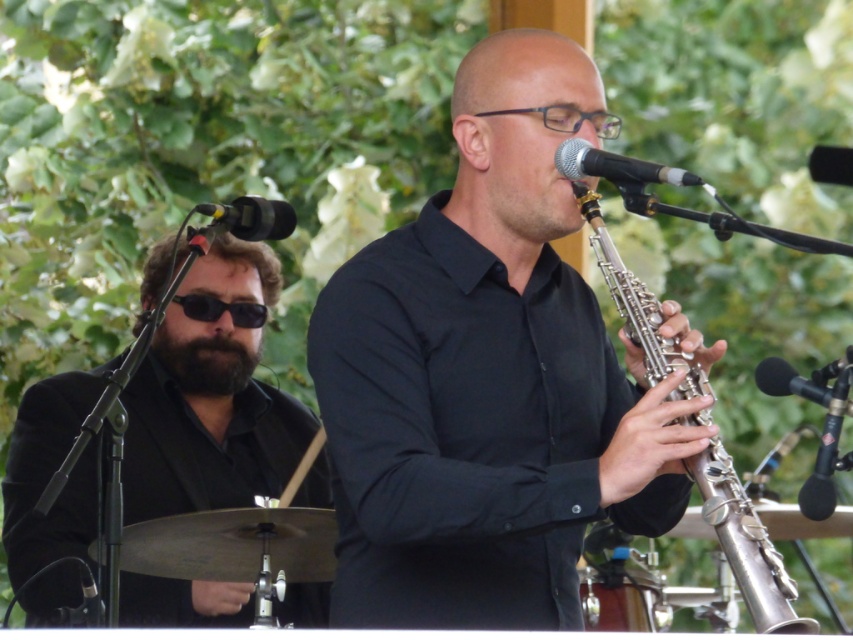
You are standing at the front of the stage facing the audience. You want to walk directly to the drummer seated at point (642, 563) without stepping on the clarinetist at point (521, 259). Is there a clear path? Explain using the coordinates provided.

Point (521, 259) is in front of point (642, 563). Since you are at the front facing the audience, moving towards the drummer would require passing behind the clarinetist, so the path is clear as long as you navigate around or behind the clarinetist at point (521, 259).

You are a photographer trying to capture a closeup of both the black matte sunglasses at left and the metallic drum at lower center in the scene. Given the distance between them, will you need to adjust your camera to a wider angle to fit both into the frame?

The black matte sunglasses at left and metallic drum at lower center are 85.09 centimeters apart. To capture both in a closeup, you would need to adjust your camera to a wider angle to accommodate the distance between them.